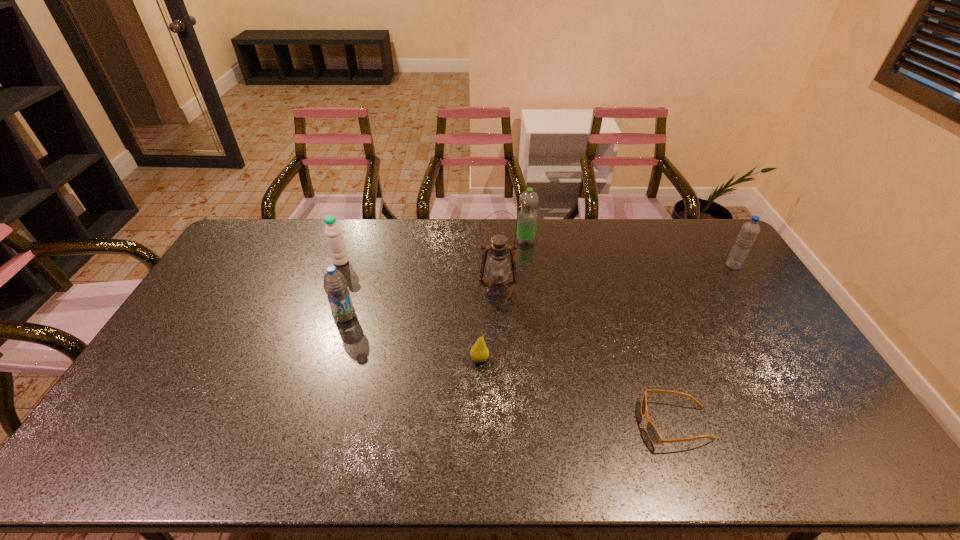
Find the location of a particular element. This screenshot has height=540, width=960. free space located on the front-facing side of the sunglasses is located at coordinates (619, 424).

What are the coordinates of `object that is at the far edge` in the screenshot? It's located at (527, 217).

At what (x,y) coordinates should I click in order to perform the action: click on object located in the near edge section of the desktop. Please return your answer as a coordinate pair (x, y). The image size is (960, 540). Looking at the image, I should click on (653, 434).

Identify the location of object at the right edge. The width and height of the screenshot is (960, 540). (750, 230).

In the image, there is a desktop. Where is `vacant space at the far edge`? The width and height of the screenshot is (960, 540). vacant space at the far edge is located at coordinates (423, 219).

The image size is (960, 540). I want to click on vacant region at the left edge of the desktop, so click(220, 280).

The height and width of the screenshot is (540, 960). Identify the location of vacant space at the right edge of the desktop. (750, 281).

Find the location of a particular element. The image size is (960, 540). unoccupied area between the second shortest object and the third nearest object is located at coordinates (412, 338).

Find the location of a particular element. empty space between the third water bottle from left to right and the third water bottle from right to left is located at coordinates (435, 279).

At what (x,y) coordinates should I click in order to perform the action: click on vacant area that lies between the rightmost water bottle and the leftmost water bottle. Please return your answer as a coordinate pair (x, y). Looking at the image, I should click on (537, 264).